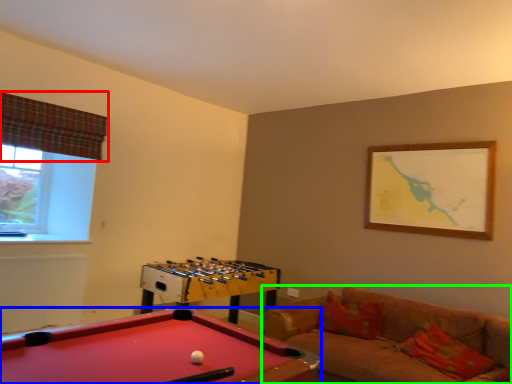
Question: Which object is the farthest from curtain (highlighted by a red box)? Choose among these: billiard table (highlighted by a blue box) or studio couch (highlighted by a green box).

Choices:
 (A) billiard table
 (B) studio couch

Answer: (B)